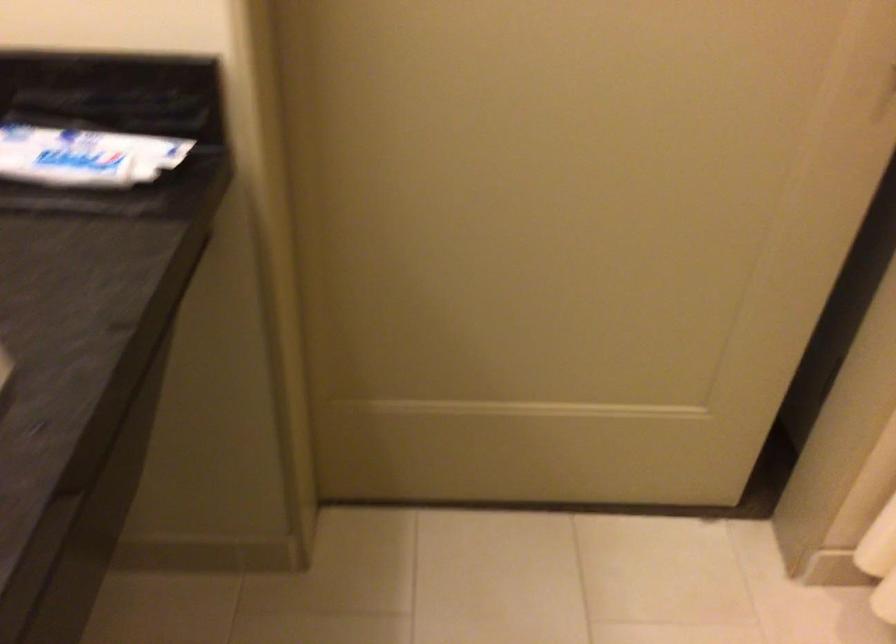
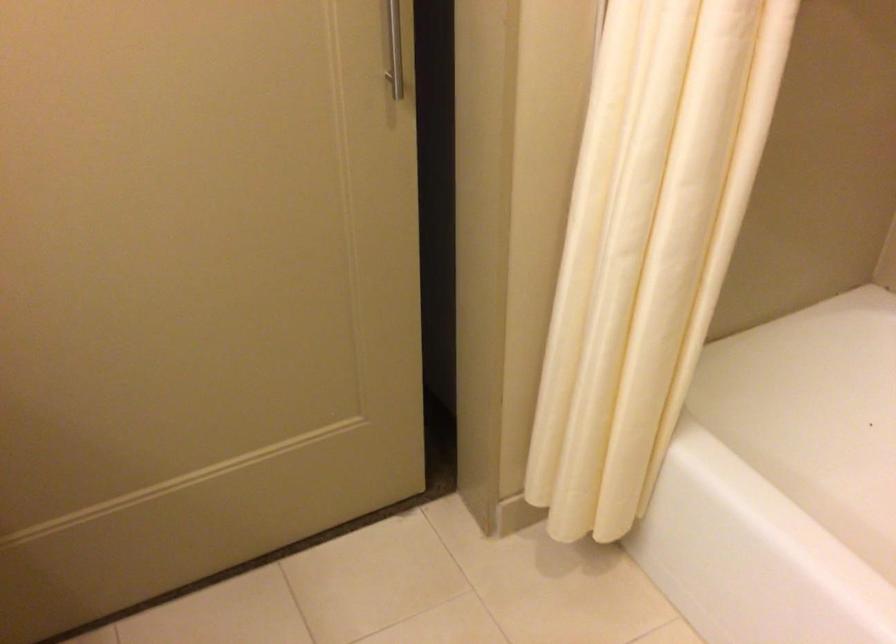
Question: The camera is either moving clockwise (left) or counter-clockwise (right) around the object. The first image is from the beginning of the video and the second image is from the end. Is the camera moving left or right when shooting the video?

Choices:
 (A) Left
 (B) Right

Answer: (A)